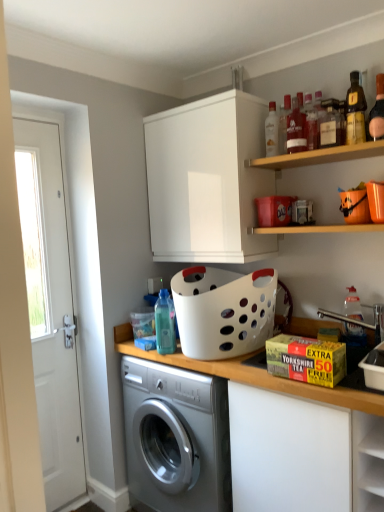
What are the coordinates of `wooden shelf at upper right, the second shelf when ordered from bottom to top` in the screenshot? It's located at (319, 156).

You are a GUI agent. You are given a task and a screenshot of the screen. Output one action in this format:
    pyautogui.click(x=<x>, y=<y>)
    Task: Click on the gold glass bottle at upper right, the 3th bottle from the right
    This screenshot has width=384, height=512.
    Given the screenshot: What is the action you would take?
    pyautogui.click(x=355, y=111)

Locate an element on the screen. translucent glass bottle at upper right, placed as the ninth bottle when sorted from left to right is located at coordinates (377, 111).

Identify the location of wooden shelf at upper right, the second shelf when ordered from bottom to top. This screenshot has height=512, width=384. (319, 156).

From the image's perspective, is white matte countertop at center positioned above or below translucent plastic bottle at center, positioned as the 9th bottle in right-to-left order?

From the image's perspective, white matte countertop at center appears below translucent plastic bottle at center, positioned as the 9th bottle in right-to-left order.

From their relative heights in the image, would you say white matte countertop at center is taller or shorter than translucent plastic bottle at center, positioned as the 9th bottle in right-to-left order?

white matte countertop at center is taller than translucent plastic bottle at center, positioned as the 9th bottle in right-to-left order.

Considering the sizes of white matte countertop at center and translucent plastic bottle at center, the first bottle in the left-to-right sequence, in the image, is white matte countertop at center wider or thinner than translucent plastic bottle at center, the first bottle in the left-to-right sequence,?

In the image, white matte countertop at center appears to be wider than translucent plastic bottle at center, the first bottle in the left-to-right sequence.

Considering the positions of points (369, 337) and (170, 344), is point (369, 337) farther from camera compared to point (170, 344)?

That is False.

Which object is positioned more to the left, translucent plastic bottle at upper center, the 3th bottle viewed from the left, or wooden shelf at upper right, the second shelf when ordered from bottom to top?

translucent plastic bottle at upper center, the 3th bottle viewed from the left, is more to the left.

Where is `the 5th bottle directly above the wooden shelf at upper right, the second shelf when ordered from bottom to top (from a real-world perspective)`? Image resolution: width=384 pixels, height=512 pixels. the 5th bottle directly above the wooden shelf at upper right, the second shelf when ordered from bottom to top (from a real-world perspective) is located at coordinates (284, 123).

Could you tell me if translucent plastic bottle at upper center, which is the 7th bottle in right-to-left order, is facing wooden shelf at upper right, the second shelf when ordered from bottom to top?

No, translucent plastic bottle at upper center, which is the 7th bottle in right-to-left order, is not turned towards wooden shelf at upper right, the second shelf when ordered from bottom to top.

Considering the relative sizes of translucent plastic bottle at upper center, which is the 7th bottle in right-to-left order, and wooden shelf at upper right, the second shelf when ordered from bottom to top, in the image provided, is translucent plastic bottle at upper center, which is the 7th bottle in right-to-left order, bigger than wooden shelf at upper right, the second shelf when ordered from bottom to top,?

Actually, translucent plastic bottle at upper center, which is the 7th bottle in right-to-left order, might be smaller than wooden shelf at upper right, the second shelf when ordered from bottom to top.

Between point (54, 351) and point (287, 116), which one is positioned behind?

Point (54, 351)

Is white glossy door at left in front of translucent plastic bottle at upper center, which is the 7th bottle in right-to-left order?

Yes, it is.

Between white glossy door at left and translucent plastic bottle at upper center, the 3th bottle viewed from the left, which one has larger width?

Wider between the two is white glossy door at left.

In the scene shown: Is white glossy door at left not close to translucent plastic bottle at upper center, the 3th bottle viewed from the left?

That's right, there is a large distance between white glossy door at left and translucent plastic bottle at upper center, the 3th bottle viewed from the left.

Would you say translucent glass bottle at upper right, which is the first bottle from right to left, is part of translucent plastic bottle at upper center, the 3th bottle viewed from the left,'s contents?

No, translucent glass bottle at upper right, which is the first bottle from right to left, is not surrounded by translucent plastic bottle at upper center, the 3th bottle viewed from the left.

Who is smaller, translucent plastic bottle at upper center, the 3th bottle viewed from the left, or translucent glass bottle at upper right, placed as the ninth bottle when sorted from left to right?

translucent glass bottle at upper right, placed as the ninth bottle when sorted from left to right, is smaller.

Looking at their sizes, would you say translucent plastic bottle at upper center, the 3th bottle viewed from the left, is wider or thinner than translucent glass bottle at upper right, placed as the ninth bottle when sorted from left to right?

In the image, translucent plastic bottle at upper center, the 3th bottle viewed from the left, appears to be wider than translucent glass bottle at upper right, placed as the ninth bottle when sorted from left to right.

Considering the relative positions of translucent plastic bottle at upper center, which is the 7th bottle in right-to-left order, and translucent glass bottle at upper right, which is the first bottle from right to left, in the image provided, is translucent plastic bottle at upper center, which is the 7th bottle in right-to-left order, in front of translucent glass bottle at upper right, which is the first bottle from right to left,?

That is False.

Is point (355, 138) positioned before point (380, 87)?

Yes.

Between gold glass bottle at upper right, the 3th bottle from the right, and translucent glass bottle at upper right, which is the first bottle from right to left, which one has larger width?

gold glass bottle at upper right, the 3th bottle from the right, is wider.

Is gold glass bottle at upper right, the 3th bottle from the right, not close to translucent glass bottle at upper right, placed as the ninth bottle when sorted from left to right?

Actually, gold glass bottle at upper right, the 3th bottle from the right, and translucent glass bottle at upper right, placed as the ninth bottle when sorted from left to right, are a little close together.

How different are the orientations of gold glass bottle at upper right, the 3th bottle from the right, and translucent glass bottle at upper right, placed as the ninth bottle when sorted from left to right, in degrees?

They differ by 0.00191 degrees in their facing directions.

Is white glossy door at left oriented away from clear glass bottle at upper center, the eighth bottle in the right-to-left sequence?

No, white glossy door at left is not facing away from clear glass bottle at upper center, the eighth bottle in the right-to-left sequence.

Which object is more forward, white glossy door at left or clear glass bottle at upper center, which is counted as the second bottle, starting from the left?

white glossy door at left.

From a real-world perspective, is white glossy door at left below clear glass bottle at upper center, the eighth bottle in the right-to-left sequence?

Indeed, from a real-world perspective, white glossy door at left is positioned beneath clear glass bottle at upper center, the eighth bottle in the right-to-left sequence.

From a real-world perspective, is white matte countertop at center beneath white matte cabinet at upper center?

Yes, from a real-world perspective, white matte countertop at center is under white matte cabinet at upper center.

Can you tell me how much white matte countertop at center and white matte cabinet at upper center differ in facing direction?

0.562 degrees separate the facing orientations of white matte countertop at center and white matte cabinet at upper center.

Considering the relative sizes of white matte countertop at center and white matte cabinet at upper center in the image provided, is white matte countertop at center wider than white matte cabinet at upper center?

Yes, white matte countertop at center is wider than white matte cabinet at upper center.

Is white matte countertop at center bigger than white matte cabinet at upper center?

Yes, white matte countertop at center is bigger than white matte cabinet at upper center.

In order to click on countertop lying on the right of translucent plastic bottle at center, the first bottle in the left-to-right sequence in this screenshot , I will do pos(252,375).

Identify the location of bottle that is the 5th object located above the wooden shelf at upper right, which appears as the 1th shelf when viewed from the top (from the image's perspective). (284, 123).

Considering their positions, is translucent plastic bottle at center, the first bottle in the left-to-right sequence, positioned further to translucent glass bottle at upper right, the 6th bottle when ordered from left to right, than translucent plastic bottle at right, the eighth bottle viewed from the left?

translucent plastic bottle at center, the first bottle in the left-to-right sequence, is further to translucent glass bottle at upper right, the 6th bottle when ordered from left to right.

When comparing their distances from wooden shelf at upper right, the second shelf when ordered from bottom to top, does clear glass bottle at upper center, the eighth bottle in the right-to-left sequence, or translucent glass bottle at upper right, the 6th bottle when ordered from left to right, seem further?

Based on the image, clear glass bottle at upper center, the eighth bottle in the right-to-left sequence, appears to be further to wooden shelf at upper right, the second shelf when ordered from bottom to top.

When comparing their distances from matte glass bottle at upper center, which is counted as the 6th bottle, starting from the right, does white matte cabinet at upper center or translucent plastic bottle at upper center, the 3th bottle viewed from the left, seem closer?

Based on the image, translucent plastic bottle at upper center, the 3th bottle viewed from the left, appears to be nearer to matte glass bottle at upper center, which is counted as the 6th bottle, starting from the right.

Estimate the real-world distances between objects in this image. Which object is further from translucent plastic bottle at right, the eighth bottle viewed from the left, translucent glass bottle at upper right, placed as the fourth bottle when sorted from right to left, or matte plastic bottle at upper right, placed as the fifth bottle when sorted from left to right?

matte plastic bottle at upper right, placed as the fifth bottle when sorted from left to right, is positioned further to the anchor translucent plastic bottle at right, the eighth bottle viewed from the left.

Estimate the real-world distances between objects in this image. Which object is further from white glossy door at left, wooden shelf at upper right, which is the second shelf from top to bottom, or matte plastic bottle at upper right, marked as the 5th bottle in a right-to-left arrangement?

matte plastic bottle at upper right, marked as the 5th bottle in a right-to-left arrangement, is positioned further to the anchor white glossy door at left.

Looking at this image, estimate the real-world distances between objects in this image. Which object is closer to white matte countertop at center, translucent plastic bottle at upper center, which is the 7th bottle in right-to-left order, or translucent glass bottle at upper right, placed as the fourth bottle when sorted from right to left?

translucent plastic bottle at upper center, which is the 7th bottle in right-to-left order.

Looking at the image, which one is located closer to white glossy door at left, translucent plastic bottle at upper center, which is the 7th bottle in right-to-left order, or matte glass bottle at upper center, which is counted as the 6th bottle, starting from the right?

translucent plastic bottle at upper center, which is the 7th bottle in right-to-left order, is positioned closer to the anchor white glossy door at left.

Considering their positions, is translucent plastic bottle at center, positioned as the 9th bottle in right-to-left order, positioned closer to translucent plastic bottle at upper center, which is the 7th bottle in right-to-left order, than wooden shelf at upper right, which appears as the 1th shelf when viewed from the top?

Based on the image, wooden shelf at upper right, which appears as the 1th shelf when viewed from the top, appears to be nearer to translucent plastic bottle at upper center, which is the 7th bottle in right-to-left order.

The width and height of the screenshot is (384, 512). In order to click on cabinetry between translucent glass bottle at upper right, placed as the ninth bottle when sorted from left to right, and translucent plastic bottle at right, the eighth bottle viewed from the left, from top to bottom in this screenshot , I will do point(207,180).

Identify the location of basket that lies between wooden shelf at upper right, the second shelf when ordered from bottom to top, and white matte countertop at center from top to bottom. (223, 311).

Find the location of a particular element. This screenshot has width=384, height=512. basket situated between translucent plastic bottle at center, the first bottle in the left-to-right sequence, and wooden shelf at upper right, which ranks as the first shelf in bottom-to-top order, from left to right is located at coordinates (223, 311).

The image size is (384, 512). In order to click on cabinetry located between white glossy door at left and wooden shelf at upper right, which is the second shelf from top to bottom, in the left-right direction in this screenshot , I will do `click(207, 180)`.